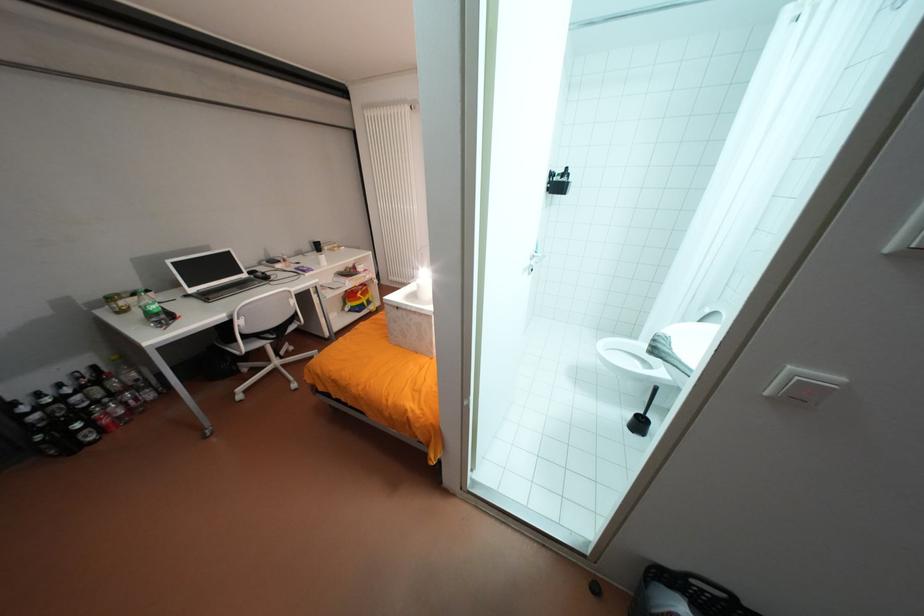
Find where to plac the black wall holder. Please return your answer as a coordinate pair (x, y).

(557, 182)